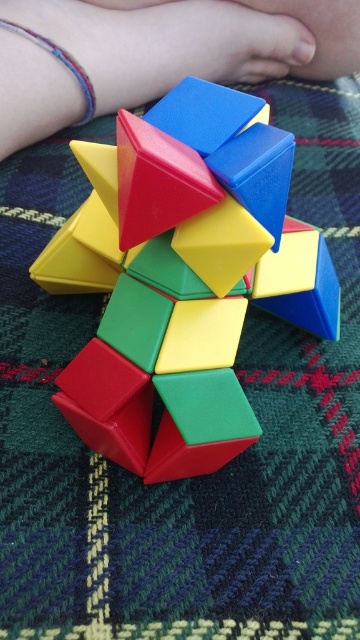
At what (x,y) coordinates should I click in order to perform the action: click on rubberized plastic puzzle at center. Please return your answer as a coordinate pair (x, y). Looking at the image, I should click on (182, 276).

I want to click on rubberized plastic puzzle at center, so click(182, 276).